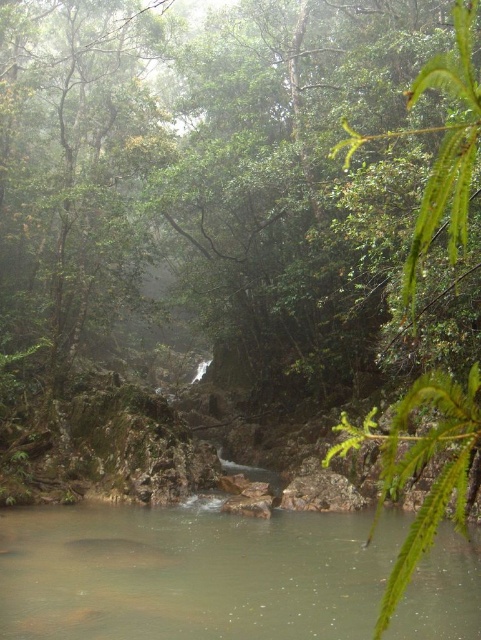
Question: Which object is farther from the camera taking this photo?

Choices:
 (A) green leafy tree at right
 (B) brown smooth river at center

Answer: (B)

Question: Which object is closer to the camera taking this photo?

Choices:
 (A) green leafy tree at right
 (B) brown smooth river at center

Answer: (A)

Question: From the image, what is the correct spatial relationship of brown smooth river at center in relation to green leafy tree at right?

Choices:
 (A) right
 (B) left

Answer: (B)

Question: Does brown smooth river at center appear on the right side of green leafy tree at right?

Choices:
 (A) no
 (B) yes

Answer: (A)

Question: Can you confirm if brown smooth river at center is positioned to the left of green leafy tree at right?

Choices:
 (A) yes
 (B) no

Answer: (A)